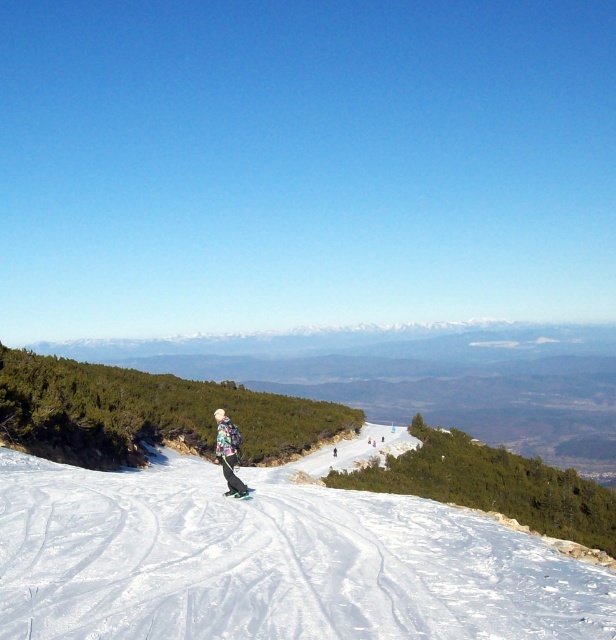
You are standing at the camera position and want to reach the point marked at coordinates point (238, 492). If you walk directly towards it, how far will you have to walk?

The distance between you and the point marked at coordinates point (238, 492) is 23.27 meters, so you will have to walk 23.27 meters to reach it.

You are a photographer standing at the bottom of the slope and want to take a photo of both the multicolored snowboard at center and the green matte ski at center. Can you fit both objects in the frame if your camera has a minimum required distance of 17 inches between the objects to capture them both clearly?

The multicolored snowboard at center is 16.75 inches from the green matte ski at center. Since the distance between them is less than the camera requirement of 17 inches, the photographer cannot fit both objects in the frame clearly.